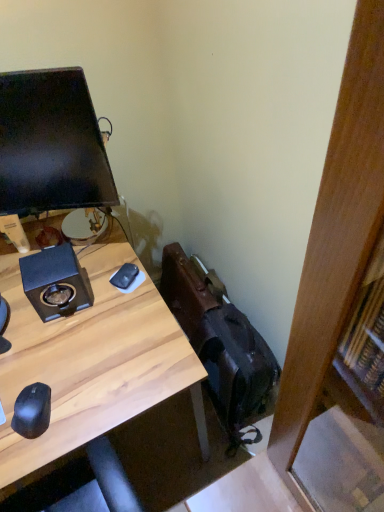
Question: Considering the positions of black matte speaker at upper left and black matte mouse at center, the 1th mouse from the right, in the image, is black matte speaker at upper left wider or thinner than black matte mouse at center, the 1th mouse from the right,?

Choices:
 (A) thin
 (B) wide

Answer: (B)

Question: Would you say black matte speaker at upper left is to the left or to the right of black matte mouse at center, which is counted as the second mouse, starting from the bottom, in the picture?

Choices:
 (A) right
 (B) left

Answer: (B)

Question: Estimate the real-world distances between objects in this image. Which object is closer to the wooden desk at center?

Choices:
 (A) matte black monitor at upper left
 (B) black matte mouse at lower left, arranged as the 2th mouse when viewed from the right
 (C) black matte speaker at upper left
 (D) black matte mouse at center, the first mouse when ordered from top to bottom

Answer: (C)

Question: Estimate the real-world distances between objects in this image. Which object is closer to the black matte speaker at upper left?

Choices:
 (A) black matte mouse at lower left, arranged as the first mouse when viewed from the left
 (B) black matte mouse at center, the second mouse viewed from the left
 (C) wooden desk at center
 (D) matte black monitor at upper left

Answer: (C)